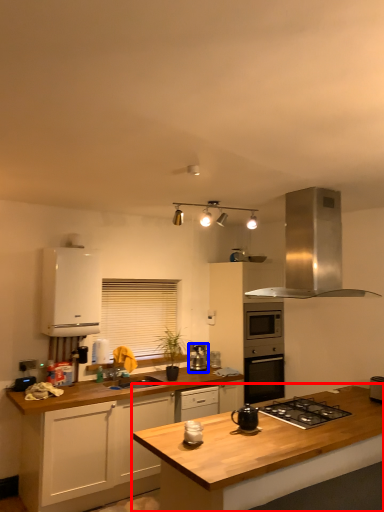
Question: Which point is closer to the camera, countertop (highlighted by a red box) or kitchen appliance (highlighted by a blue box)?

Choices:
 (A) countertop
 (B) kitchen appliance

Answer: (A)